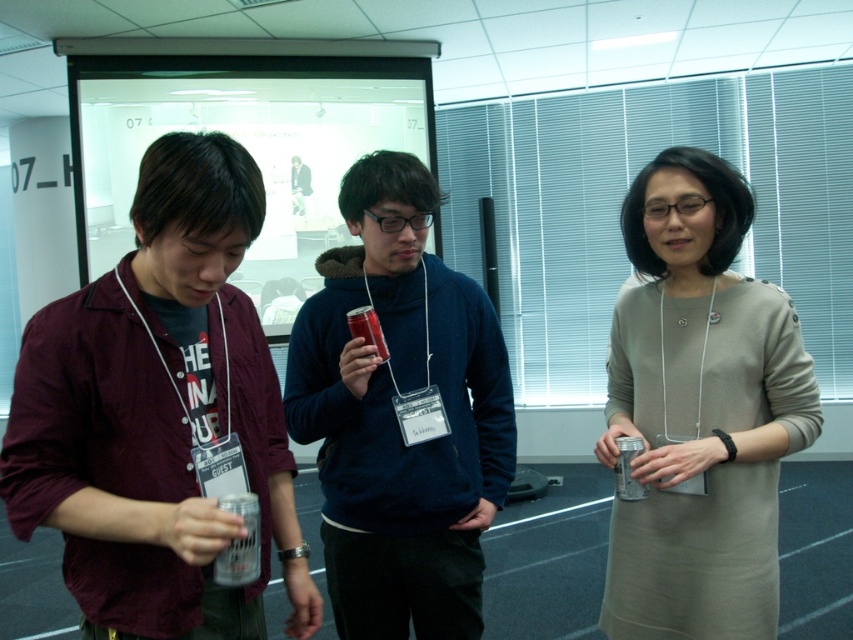
You are organizing a photo shoot and need to arrange the maroon shirt at left and the matte gray dress at center based on their sizes. Which should you place first if you want to start with the smaller object?

The maroon shirt at left should be placed first since it occupies less space than the matte gray dress at center.

You are standing in the conference room and need to find the matte gray dress at center. According to the coordinates provided, where should you look to locate it?

The matte gray dress at center is located at the 2D coordinates point (699,412).

You are a photographer setting up for a group photo in the conference room. You need to position the maroon shirt at left and the matte blue hoodie at center so that both are visible. Given their heights, which person should you place closer to the camera to ensure their faces are visible?

The maroon shirt at left is shorter than the matte blue hoodie at center. To ensure both faces are visible, position the maroon shirt at left closer to the camera so their face isn not obscured by the taller person behind.